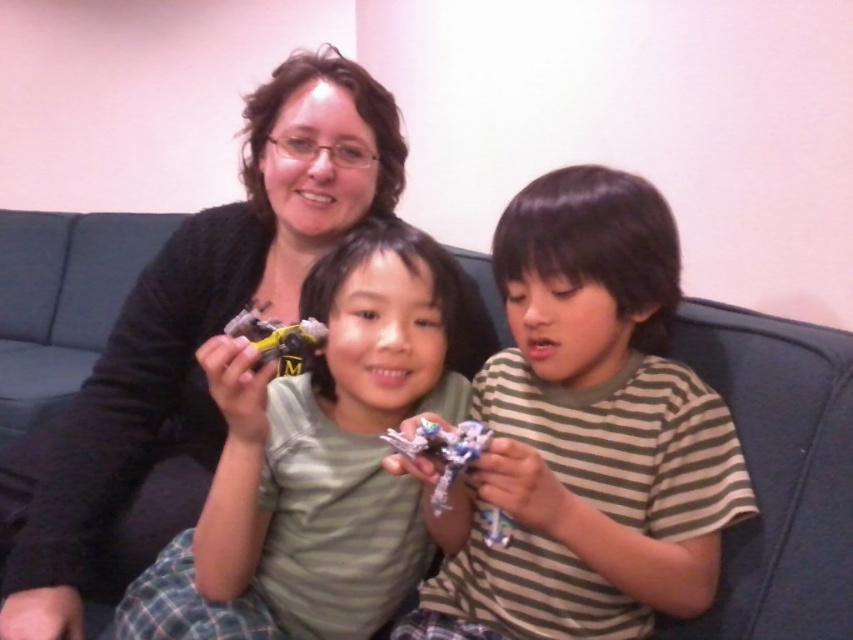
You are a parent trying to organize toys in a storage box that can only hold items within 12 inches of each other. You see the metallic silver toy at center and the yellow plastic toy at center. Can both toys be placed in the box without exceeding the distance requirement?

The distance between the metallic silver toy at center and the yellow plastic toy at center is 12.89 inches, which exceeds the 12 inches requirement. Therefore, they cannot be placed in the box together without violating the distance constraint.

Looking at this image, you are a photographer taking a picture of the two toys on the couch. You notice the metallic silver toy at center and the yellow plastic toy at center. Which toy should you adjust to ensure both are in focus? Explain your reasoning.

The metallic silver toy at center is closer to the viewer than the yellow plastic toy at center. To ensure both are in focus, you should move the yellow plastic toy at center closer to the camera so it aligns with the distance of the metallic silver toy at center.

You are a parent trying to organize your childrens toys. You see the metallic silver toy at center and the yellow plastic toy at center. Which toy is located to the right side of the other?

The metallic silver toy at center is to the right of the yellow plastic toy at center.